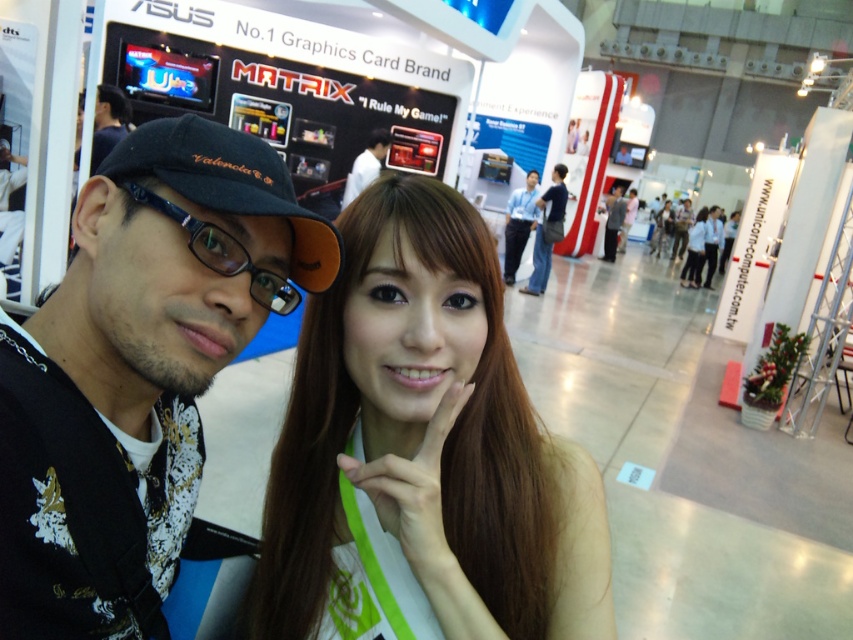
Question: Is blue jeans at center below matte black cap at upper left?

Choices:
 (A) no
 (B) yes

Answer: (B)

Question: Which point appears closest to the camera in this image?

Choices:
 (A) (718, 228)
 (B) (136, 385)
 (C) (312, 273)
 (D) (622, 220)

Answer: (B)

Question: Estimate the real-world distances between objects in this image. Which object is farther from the blue shirt at center?

Choices:
 (A) smooth brown hair at center
 (B) matte black cap at left
 (C) matte black glasses at left
 (D) blue jeans at center

Answer: (C)

Question: Can you confirm if matte black cap at left is wider than gray fabric shirt at center?

Choices:
 (A) no
 (B) yes

Answer: (A)

Question: Does matte black cap at left appear over matte black glasses at left?

Choices:
 (A) no
 (B) yes

Answer: (A)

Question: Estimate the real-world distances between objects in this image. Which object is closer to the blue jeans at center?

Choices:
 (A) matte black hair at center
 (B) gray fabric shirt at center
 (C) smooth brown hair at center
 (D) matte black cap at left

Answer: (A)